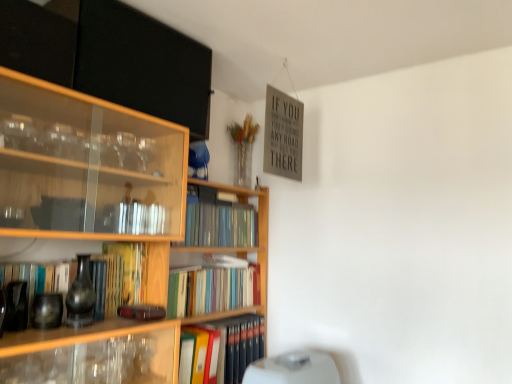
Question: Considering the relative sizes of wooden bookcase at center and hardcover books at center, the 1th book when ordered from top to bottom, in the image provided, is wooden bookcase at center smaller than hardcover books at center, the 1th book when ordered from top to bottom,?

Choices:
 (A) no
 (B) yes

Answer: (A)

Question: Can you confirm if wooden bookcase at center is positioned to the left of hardcover books at center, the 1th book when ordered from top to bottom?

Choices:
 (A) no
 (B) yes

Answer: (B)

Question: Considering the relative sizes of wooden bookcase at center and hardcover books at center, the 1th book when ordered from top to bottom, in the image provided, is wooden bookcase at center thinner than hardcover books at center, the 1th book when ordered from top to bottom,?

Choices:
 (A) yes
 (B) no

Answer: (B)

Question: From the image's perspective, is wooden bookcase at center above hardcover books at center, the 1th book when ordered from top to bottom?

Choices:
 (A) yes
 (B) no

Answer: (B)

Question: Is wooden bookcase at center aimed at hardcover books at center, the 1th book when ordered from top to bottom?

Choices:
 (A) yes
 (B) no

Answer: (A)

Question: From a real-world perspective, is matte black book at left, the 3th book from the bottom, positioned above or below hardcover book at center, placed as the 3th book when sorted from top to bottom?

Choices:
 (A) below
 (B) above

Answer: (B)

Question: Would you say matte black book at left, marked as the 2th book in a top-to-bottom arrangement, is to the left or to the right of hardcover book at center, the 2th book positioned from the bottom, in the picture?

Choices:
 (A) left
 (B) right

Answer: (A)

Question: Looking at their shapes, would you say matte black book at left, the 3th book from the bottom, is wider or thinner than hardcover book at center, placed as the 3th book when sorted from top to bottom?

Choices:
 (A) wide
 (B) thin

Answer: (A)

Question: From the image's perspective, relative to hardcover book at center, the 2th book positioned from the bottom, is matte black book at left, the 3th book from the bottom, above or below?

Choices:
 (A) above
 (B) below

Answer: (A)

Question: From their relative heights in the image, would you say hardcover book at center, placed as the 3th book when sorted from top to bottom, is taller or shorter than white plastic water heater at lower center?

Choices:
 (A) short
 (B) tall

Answer: (A)

Question: Is point (203, 266) positioned closer to the camera than point (308, 355)?

Choices:
 (A) closer
 (B) farther

Answer: (B)

Question: Looking at the image, does hardcover book at center, the 2th book positioned from the bottom, seem bigger or smaller compared to white plastic water heater at lower center?

Choices:
 (A) small
 (B) big

Answer: (A)

Question: Relative to white plastic water heater at lower center, is hardcover book at center, the 2th book positioned from the bottom, in front or behind?

Choices:
 (A) behind
 (B) front

Answer: (A)

Question: In terms of height, does hardcover book at center, placed as the 3th book when sorted from top to bottom, look taller or shorter compared to hardcover books at center, the 1th book when ordered from top to bottom?

Choices:
 (A) short
 (B) tall

Answer: (B)

Question: Does point (181, 288) appear closer or farther from the camera than point (250, 233)?

Choices:
 (A) closer
 (B) farther

Answer: (A)